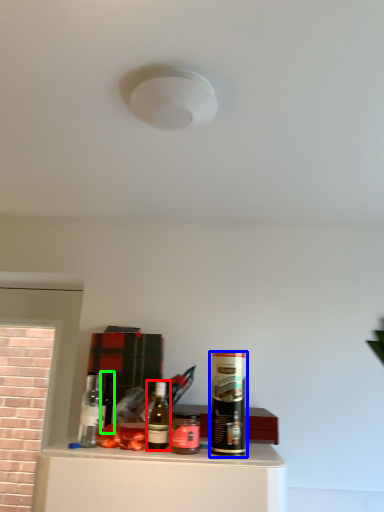
Question: Which object is positioned closest to bottle (highlighted by a red box)? Select from beverage (highlighted by a blue box) and wine bottle (highlighted by a green box).

Choices:
 (A) beverage
 (B) wine bottle

Answer: (A)